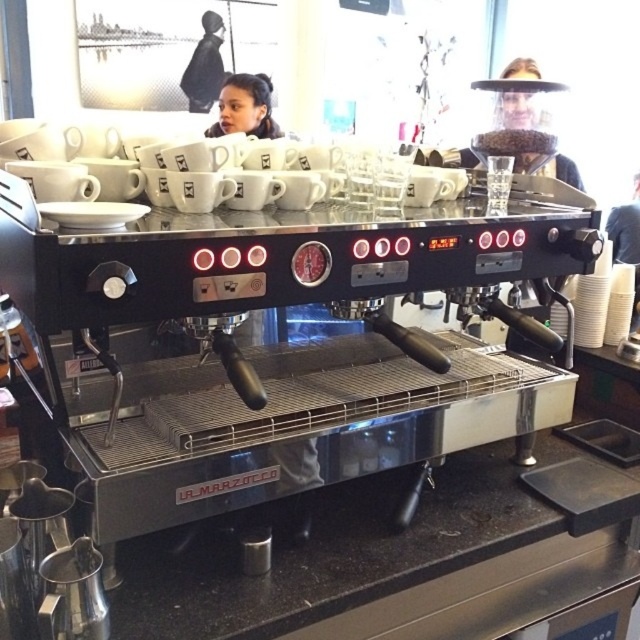
Question: Does black granite countertop at lower center appear on the left side of clear plastic face shield at upper center?

Choices:
 (A) yes
 (B) no

Answer: (A)

Question: Which point is farther from the camera taking this photo?

Choices:
 (A) (467, 148)
 (B) (225, 621)

Answer: (A)

Question: Does black granite countertop at lower center have a lesser width compared to clear plastic face shield at upper center?

Choices:
 (A) yes
 (B) no

Answer: (B)

Question: Is black granite countertop at lower center thinner than clear plastic face shield at upper center?

Choices:
 (A) no
 (B) yes

Answer: (A)